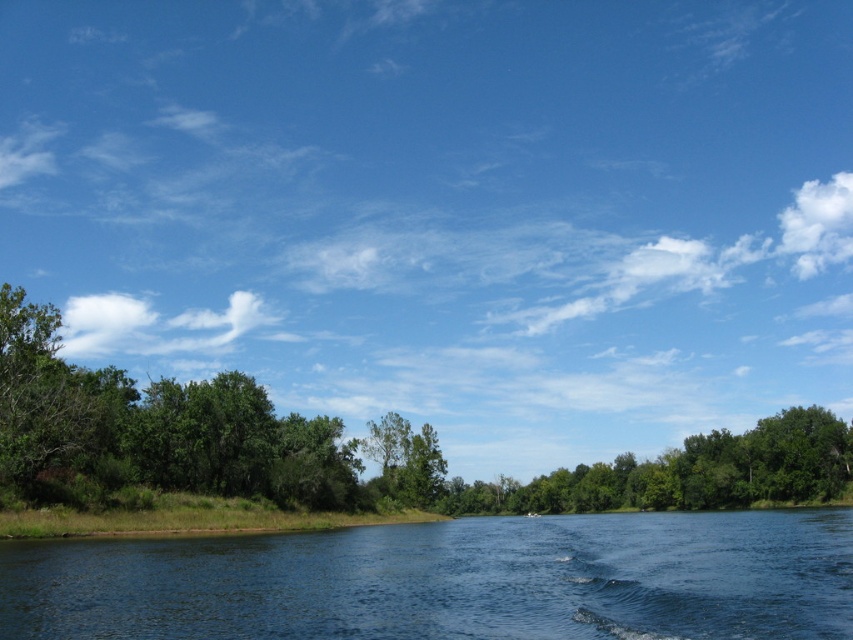
You are standing at the riverside and looking at two points in the scene. The first point is at coordinates point (355,556) and the second point is at point (137,426). Which point is closer to your current position?

Point (355,556) is closer to the camera than point (137,426), so the first point is closer to your current position.

You are standing on the riverside and want to throw a stone into the blue smooth water at center. If you can throw a stone 15 meters, will it land in the water?

The distance between you and the blue smooth water at center is 16.20 meters. Since your throwing distance is 15 meters, the stone will not reach the water.

You are a photographer planning to capture a wide shot of the riverside scene. Given that your camera can only focus on objects within a 5 meter width, will the blue smooth water at center and the green leafy tree at lower center both fit within the camera frame?

The blue smooth water at center has a width less than the green leafy tree at lower center. Since the camera can focus on objects within a 5 meter width, both objects can fit within the frame as their combined width is less than 5 meters.